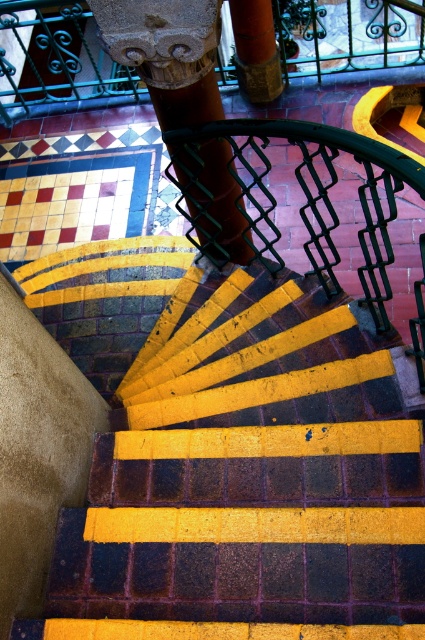
Is green wrought iron at upper center shorter than rustic stone column at center?

Correct, green wrought iron at upper center is not as tall as rustic stone column at center.

Is point (303, 20) positioned before point (210, 152)?

No, it is behind (210, 152).

Measure the distance between green wrought iron at upper center and camera.

green wrought iron at upper center is 22.31 feet from camera.

Locate an element on the screen. Image resolution: width=425 pixels, height=640 pixels. green wrought iron at upper center is located at coordinates (56, 60).

Between point (192, 394) and point (198, 179), which one is positioned in front?

Point (192, 394) is more forward.

This screenshot has height=640, width=425. What are the coordinates of `yellow painted brick stairs at center` in the screenshot? It's located at (249, 480).

Can you confirm if rustic stone column at center is wider than orange matte pillar at upper center?

Correct, the width of rustic stone column at center exceeds that of orange matte pillar at upper center.

Does point (201, 44) come behind point (274, 42)?

No.

Describe the element at coordinates (167, 52) in the screenshot. The height and width of the screenshot is (640, 425). I see `rustic stone column at center` at that location.

I want to click on rustic stone column at center, so click(167, 52).